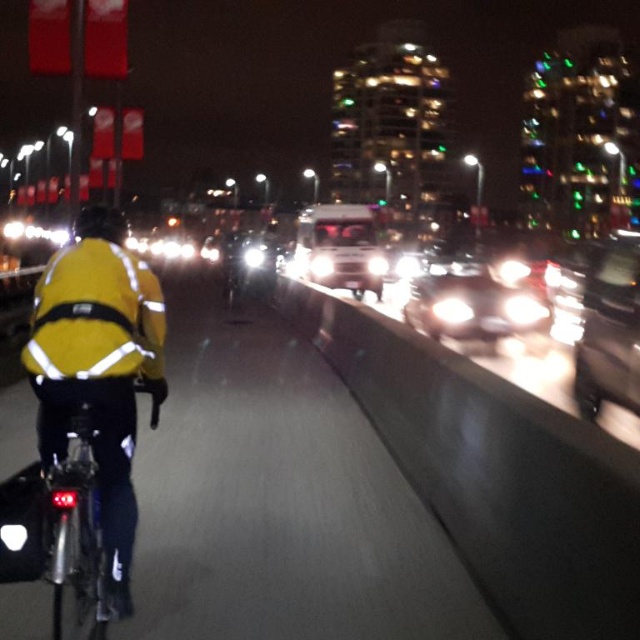
Question: Considering the real-world distances, which object is closest to the reflective plastic bicycle at left?

Choices:
 (A) yellow reflective jacket at center
 (B) shiny silver sedan at center
 (C) shiny silver sedan at right

Answer: (A)

Question: Is reflective plastic bicycle at left thinner than shiny silver sedan at right?

Choices:
 (A) no
 (B) yes

Answer: (A)

Question: Among these points, which one is nearest to the camera?

Choices:
 (A) (426, 324)
 (B) (371, 520)

Answer: (B)

Question: Is yellow reflective jacket at center positioned behind shiny silver sedan at center?

Choices:
 (A) yes
 (B) no

Answer: (B)

Question: Which object is the farthest from the yellow reflective jacket at center?

Choices:
 (A) reflective plastic bicycle at left
 (B) yellow reflective helmet at upper left
 (C) shiny silver sedan at center
 (D) shiny silver sedan at right

Answer: (C)

Question: Where is yellow reflective jacket at center located in relation to shiny silver sedan at right in the image?

Choices:
 (A) right
 (B) left

Answer: (B)